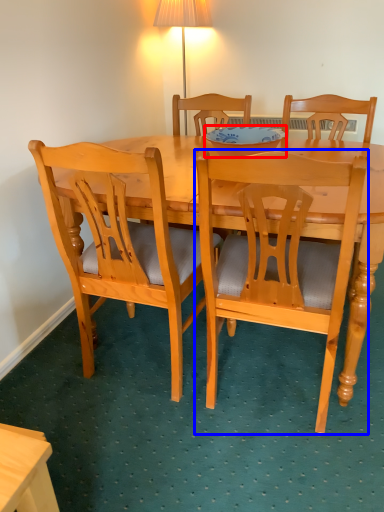
Question: Which of the following is the farthest to the observer, bowl (highlighted by a red box) or chair (highlighted by a blue box)?

Choices:
 (A) bowl
 (B) chair

Answer: (A)